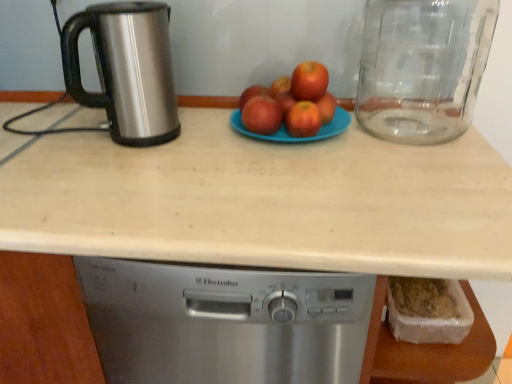
Find the location of `vacant space situated on the left part of stainless steel kettle at left`. vacant space situated on the left part of stainless steel kettle at left is located at coordinates (60, 145).